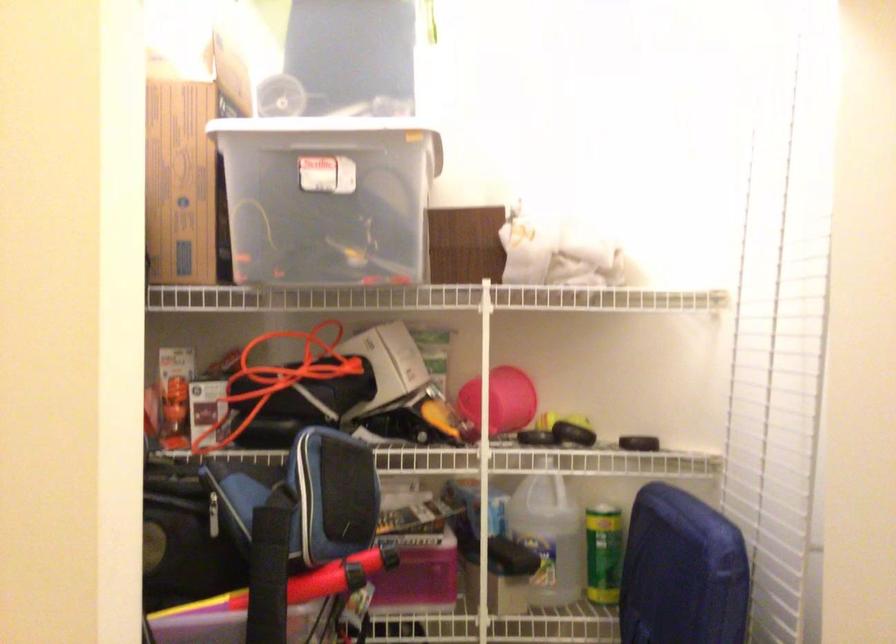
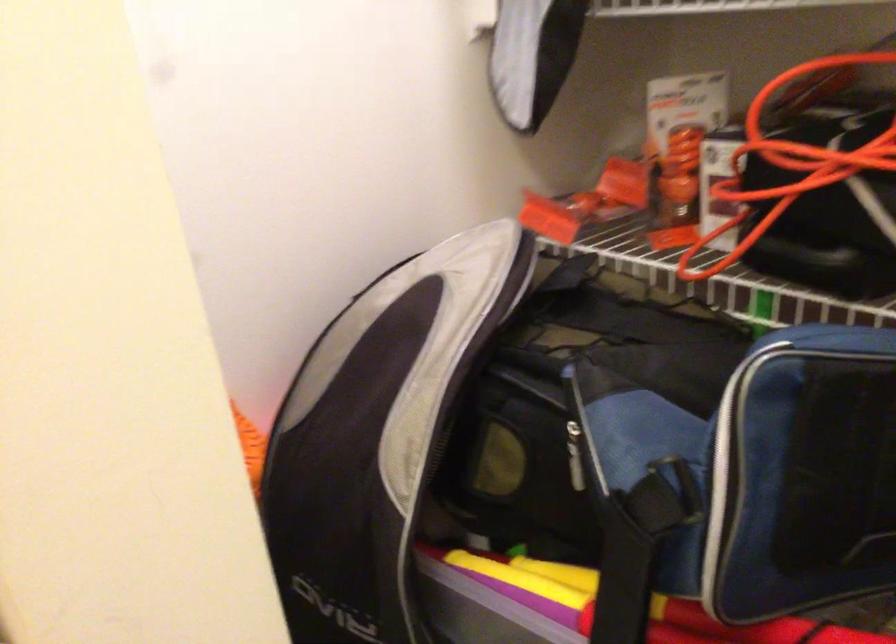
How did the camera likely rotate?

The camera's rotation is toward left-down.